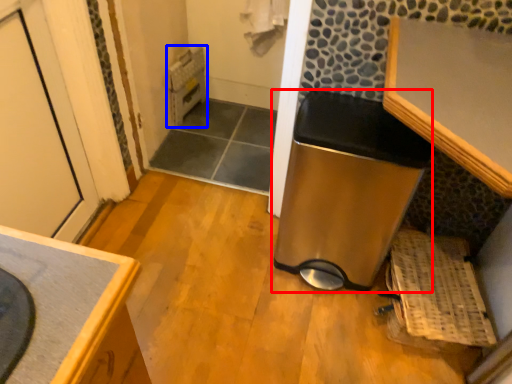
Question: Which object is further to the camera taking this photo, water heater (highlighted by a red box) or water heater (highlighted by a blue box)?

Choices:
 (A) water heater
 (B) water heater

Answer: (B)